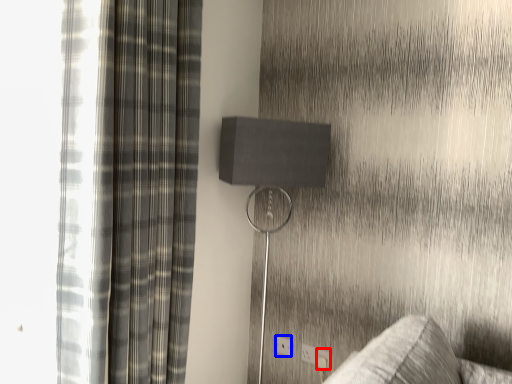
Question: Which object appears closest to the camera in this image, electric outlet (highlighted by a red box) or electric outlet (highlighted by a blue box)?

Choices:
 (A) electric outlet
 (B) electric outlet

Answer: (A)